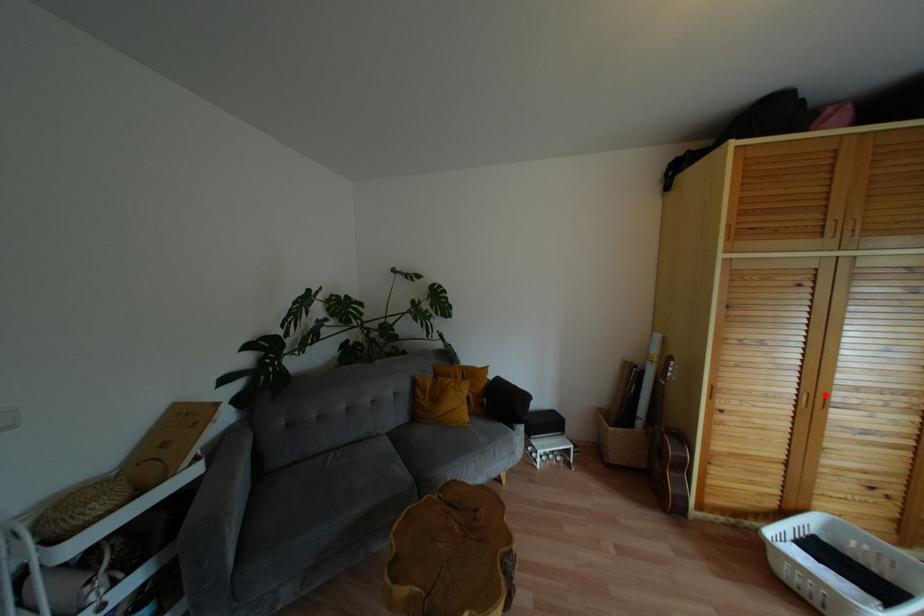
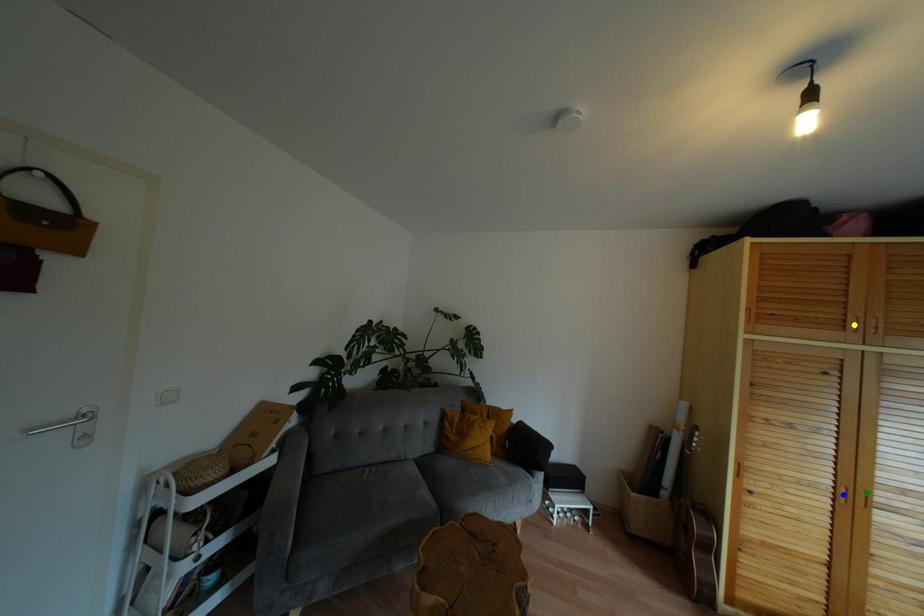
Question: I am providing you with two images of the same scene from different viewpoints. A red point is marked on the first image. You are given multiple points on the second image. Which mark in image 2 goes with the point in image 1?

Choices:
 (A) blue point
 (B) yellow point
 (C) green point

Answer: (C)